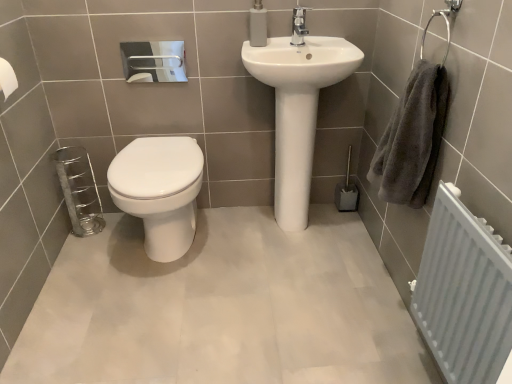
The image size is (512, 384). Find the location of `vacant region below white glossy toilet at center (from a real-world perspective)`. vacant region below white glossy toilet at center (from a real-world perspective) is located at coordinates (172, 252).